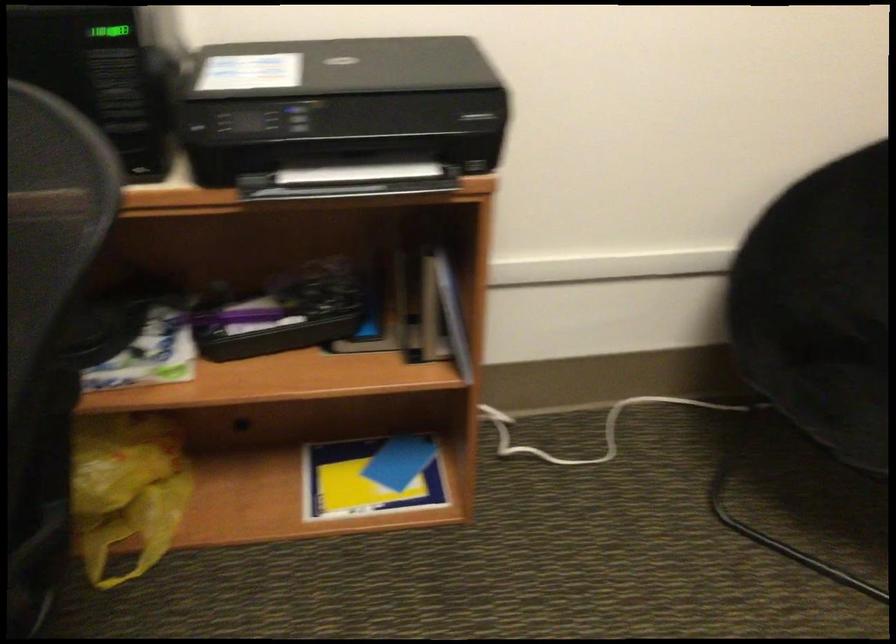
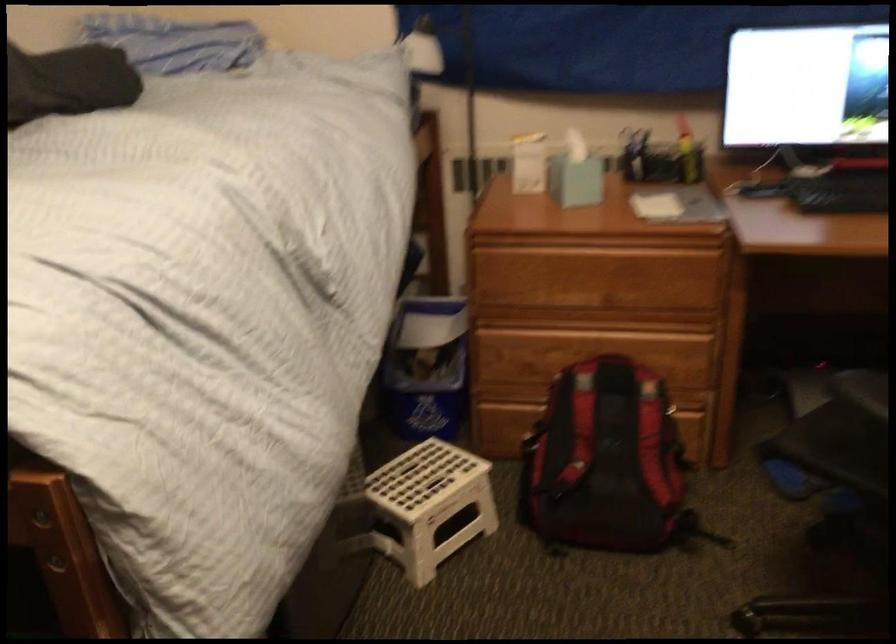
Consider the image. First-person continuous shooting, in which direction is the camera rotating?

The camera rotated toward left-down.